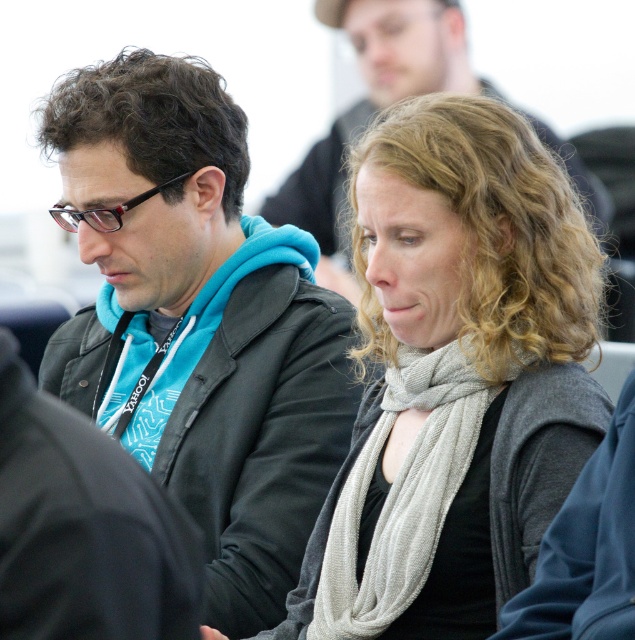
You are a photographer trying to capture a closeup shot of the light gray scarf at center and the gray knitted scarf at center. Which scarf should you move your camera to the left to focus on?

The light gray scarf at center is to the right of gray knitted scarf at center, so to focus on the gray knitted scarf at center, you should move the camera to the left.

You are a photographer taking a portrait of the two people in the image. You want to ensure that both the light gray scarf at center and the gray knitted scarf at center are clearly visible in the photo. Based on their positions, which scarf should you focus on to achieve this?

The light gray scarf at center is in front of the gray knitted scarf at center, so focusing on the light gray scarf at center will ensure both are visible as it is closer to the camera.

You are organizing a charity clothing drive and need to determine which item takes up more space for storage. Based on the image, which item between the matte black jacket at left and the light gray scarf at center requires more storage space?

The matte black jacket at left requires more storage space because it has a larger size compared to the light gray scarf at center.